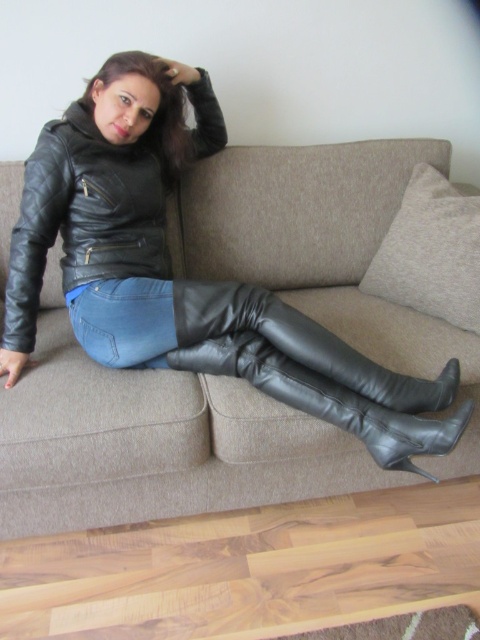
Who is positioned more to the right, beige fabric couch at center or black leather thigh-high boots at center?

black leather thigh-high boots at center is more to the right.

Can you confirm if beige fabric couch at center is positioned to the right of black leather thigh-high boots at center?

Incorrect, beige fabric couch at center is not on the right side of black leather thigh-high boots at center.

Does point (359, 300) come in front of point (180, 310)?

No.

The height and width of the screenshot is (640, 480). What are the coordinates of `beige fabric couch at center` in the screenshot? It's located at (154, 442).

Between black leather thigh-high boots at center and blue denim jeans at center, which one has less height?

Standing shorter between the two is blue denim jeans at center.

Which is behind, point (416, 401) or point (92, 332)?

Positioned behind is point (92, 332).

Find the location of `black leather thigh-high boots at center`. black leather thigh-high boots at center is located at coordinates (290, 355).

Is black quilted leather jacket at upper left to the left of blue denim jeans at center from the viewer's perspective?

Correct, you'll find black quilted leather jacket at upper left to the left of blue denim jeans at center.

Which is behind, point (49, 230) or point (79, 326)?

The point (49, 230) is behind.

Identify the location of black quilted leather jacket at upper left. This screenshot has width=480, height=640. (84, 216).